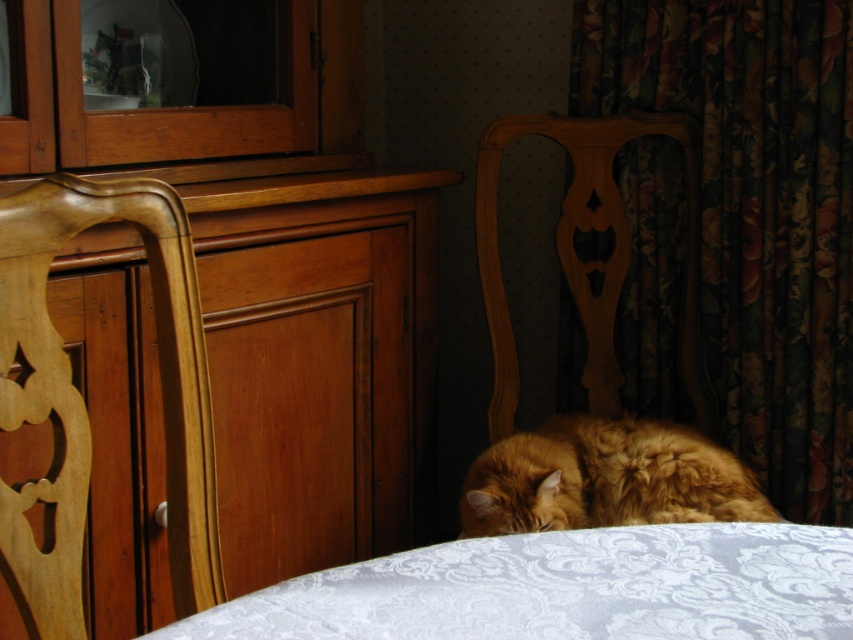
Question: Does wooden chair at center have a smaller size compared to orange fluffy cat at lower center?

Choices:
 (A) yes
 (B) no

Answer: (B)

Question: Which object appears farthest from the camera in this image?

Choices:
 (A) floral fabric curtain at right
 (B) wooden dresser at left
 (C) white damask fabric at lower center
 (D) wooden carved chair at left

Answer: (A)

Question: Does floral fabric curtain at right have a greater width compared to wooden chair at center?

Choices:
 (A) no
 (B) yes

Answer: (B)

Question: Among these objects, which one is nearest to the camera?

Choices:
 (A) wooden dresser at left
 (B) orange fluffy cat at lower center
 (C) wooden carved chair at left
 (D) white damask fabric at lower center

Answer: (D)

Question: Considering the real-world distances, which object is farthest from the wooden chair at center?

Choices:
 (A) white damask fabric at lower center
 (B) wooden carved chair at left
 (C) floral fabric curtain at right
 (D) orange fluffy cat at lower center

Answer: (A)

Question: Does wooden carved chair at left have a lesser width compared to wooden chair at center?

Choices:
 (A) yes
 (B) no

Answer: (A)